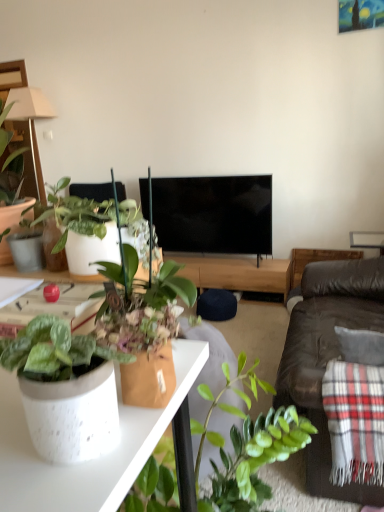
Locate an element on the screen. speckled ceramic pot at lower left, arranged as the second houseplant when viewed from the top is located at coordinates (146, 336).

Between speckled ceramic pot at lower left, arranged as the first houseplant when viewed from the right, and plaid woolen blanket at right, which one has smaller size?

Smaller between the two is speckled ceramic pot at lower left, arranged as the first houseplant when viewed from the right.

Is speckled ceramic pot at lower left, the second houseplant in the back-to-front sequence, positioned behind plaid woolen blanket at right?

No, the depth of speckled ceramic pot at lower left, the second houseplant in the back-to-front sequence, is less than that of plaid woolen blanket at right.

Considering the sizes of objects speckled ceramic pot at lower left, the second houseplant in the left-to-right sequence, and plaid woolen blanket at right in the image provided, who is wider, speckled ceramic pot at lower left, the second houseplant in the left-to-right sequence, or plaid woolen blanket at right?

plaid woolen blanket at right.

Considering the relative positions of speckled ceramic pot at lower left, arranged as the second houseplant when viewed from the top, and plaid woolen blanket at right in the image provided, is speckled ceramic pot at lower left, arranged as the second houseplant when viewed from the top, to the right of plaid woolen blanket at right from the viewer's perspective?

Incorrect, speckled ceramic pot at lower left, arranged as the second houseplant when viewed from the top, is not on the right side of plaid woolen blanket at right.

Can you confirm if black glossy tv at center is positioned to the right of plaid woolen blanket at right?

No, black glossy tv at center is not to the right of plaid woolen blanket at right.

From the image's perspective, which object appears higher, black glossy tv at center or plaid woolen blanket at right?

From the image's view, black glossy tv at center is above.

Does black glossy tv at center contain plaid woolen blanket at right?

No, black glossy tv at center does not contain plaid woolen blanket at right.

Does black glossy tv at center turn towards plaid woolen blanket at right?

Yes, black glossy tv at center is oriented towards plaid woolen blanket at right.

Who is taller, plaid woolen blanket at right or beige fabric lamp at upper left?

With more height is plaid woolen blanket at right.

From a real-world perspective, which is physically below, plaid woolen blanket at right or beige fabric lamp at upper left?

plaid woolen blanket at right is physically lower.

Which is in front, point (341, 433) or point (48, 110)?

Positioned in front is point (341, 433).

Looking at this image, considering the sizes of objects plaid woolen blanket at right and beige fabric lamp at upper left in the image provided, who is wider, plaid woolen blanket at right or beige fabric lamp at upper left?

With larger width is plaid woolen blanket at right.

Considering the positions of point (127, 372) and point (22, 96), is point (127, 372) closer or farther from the camera than point (22, 96)?

Clearly, point (127, 372) is closer to the camera than point (22, 96).

Which is more to the right, speckled ceramic pot at lower left, arranged as the first houseplant when ordered from the bottom, or beige fabric lamp at upper left?

From the viewer's perspective, speckled ceramic pot at lower left, arranged as the first houseplant when ordered from the bottom, appears more on the right side.

Looking at their sizes, would you say speckled ceramic pot at lower left, which is the first houseplant in front-to-back order, is wider or thinner than beige fabric lamp at upper left?

Considering their sizes, speckled ceramic pot at lower left, which is the first houseplant in front-to-back order, looks slimmer than beige fabric lamp at upper left.

Is brown leather couch at right inside or outside of white speckled ceramic pot at lower left?

brown leather couch at right is not enclosed by white speckled ceramic pot at lower left.

Between point (308, 464) and point (185, 421), which one is positioned behind?

The point (308, 464) is farther.

Is brown leather couch at right facing towards white speckled ceramic pot at lower left?

No, brown leather couch at right is not oriented towards white speckled ceramic pot at lower left.

Considering their positions, is black glossy tv at center located in front of or behind white speckled ceramic pot at lower left?

In the image, black glossy tv at center appears behind white speckled ceramic pot at lower left.

Which object is wider, black glossy tv at center or white speckled ceramic pot at lower left?

With larger width is black glossy tv at center.

What's the angular difference between black glossy tv at center and white speckled ceramic pot at lower left's facing directions?

180 degrees separate the facing orientations of black glossy tv at center and white speckled ceramic pot at lower left.

In terms of size, does black glossy tv at center appear bigger or smaller than white speckled ceramic pot at lower left?

Clearly, black glossy tv at center is larger in size than white speckled ceramic pot at lower left.

The image size is (384, 512). I want to click on studio couch located below the beige fabric lamp at upper left (from the image's perspective), so click(x=328, y=356).

From a real-world perspective, who is located higher, beige fabric lamp at upper left or brown leather couch at right?

In real-world perspective, beige fabric lamp at upper left is above.

Is the surface of beige fabric lamp at upper left in direct contact with brown leather couch at right?

No, beige fabric lamp at upper left is not next to brown leather couch at right.

Consider the image. Is brown leather couch at right at the back of beige fabric lamp at upper left?

beige fabric lamp at upper left does not have its back to brown leather couch at right.

Where is `houseplant that is the 1st object above the plaid woolen blanket at right (from a real-world perspective)`? houseplant that is the 1st object above the plaid woolen blanket at right (from a real-world perspective) is located at coordinates (146, 336).

I want to click on television lying behind the plaid woolen blanket at right, so click(x=214, y=214).

Which object lies further to the anchor point brown leather couch at right, beige fabric lamp at upper left or black glossy tv at center?

beige fabric lamp at upper left.

Looking at the image, which one is located closer to white speckled ceramic pot at lower left, plaid woolen blanket at right or black glossy tv at center?

plaid woolen blanket at right.

Considering their positions, is black glossy tv at center positioned further to white speckled pot at left, the 2th houseplant positioned from the front, than brown leather couch at right?

black glossy tv at center.

From the image, which object appears to be nearer to white speckled ceramic pot at lower left, speckled ceramic pot at lower left, arranged as the first houseplant when ordered from the bottom, or beige fabric lamp at upper left?

speckled ceramic pot at lower left, arranged as the first houseplant when ordered from the bottom.

Considering their positions, is white speckled pot at left, which appears as the 1th houseplant when viewed from the back, positioned closer to brown leather couch at right than plaid woolen blanket at right?

plaid woolen blanket at right lies closer to brown leather couch at right than the other object.

When comparing their distances from white speckled ceramic pot at lower left, does black glossy tv at center or brown leather couch at right seem further?

black glossy tv at center is positioned further to the anchor white speckled ceramic pot at lower left.

From the image, which object appears to be farther from white speckled ceramic pot at lower left, black glossy tv at center or speckled ceramic pot at lower left, the second houseplant in the back-to-front sequence?

Based on the image, black glossy tv at center appears to be further to white speckled ceramic pot at lower left.

Looking at this image, considering their positions, is brown leather couch at right positioned further to white speckled ceramic pot at lower left than plaid woolen blanket at right?

brown leather couch at right is further to white speckled ceramic pot at lower left.

This screenshot has width=384, height=512. I want to click on studio couch between beige fabric lamp at upper left and black glossy tv at center in the front-back direction, so click(328, 356).

At what (x,y) coordinates should I click in order to perform the action: click on houseplant between beige fabric lamp at upper left and speckled ceramic pot at lower left, arranged as the first houseplant when ordered from the bottom, in the horizontal direction. Please return your answer as a coordinate pair (x, y). Looking at the image, I should click on (91, 228).

Find the location of a particular element. The image size is (384, 512). houseplant between white speckled ceramic pot at lower left and plaid woolen blanket at right is located at coordinates (146, 336).

Identify the location of blanket between beige fabric lamp at upper left and brown leather couch at right from left to right. (355, 422).